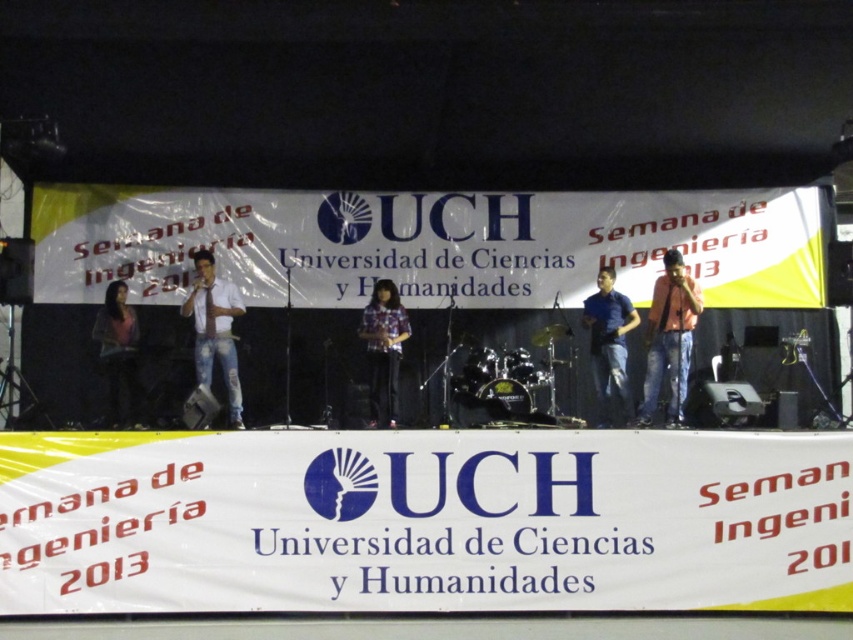
Question: Based on their relative distances, which object is farther from the plaid fabric shirt at center?

Choices:
 (A) matte black dress at left
 (B) white denim jeans at center
 (C) blue denim jeans at center

Answer: (A)

Question: Does matte black shirt at right appear under matte black dress at left?

Choices:
 (A) no
 (B) yes

Answer: (A)

Question: Does white denim jeans at center appear over plaid fabric shirt at center?

Choices:
 (A) no
 (B) yes

Answer: (B)

Question: Among these points, which one is nearest to the camera?

Choices:
 (A) (654, 346)
 (B) (218, 310)
 (C) (370, 360)
 (D) (601, 305)

Answer: (A)

Question: Is blue denim jeans at center wider than matte black dress at left?

Choices:
 (A) yes
 (B) no

Answer: (B)

Question: Which object is positioned closest to the plaid fabric shirt at center?

Choices:
 (A) white denim jeans at center
 (B) blue denim jeans at center

Answer: (A)